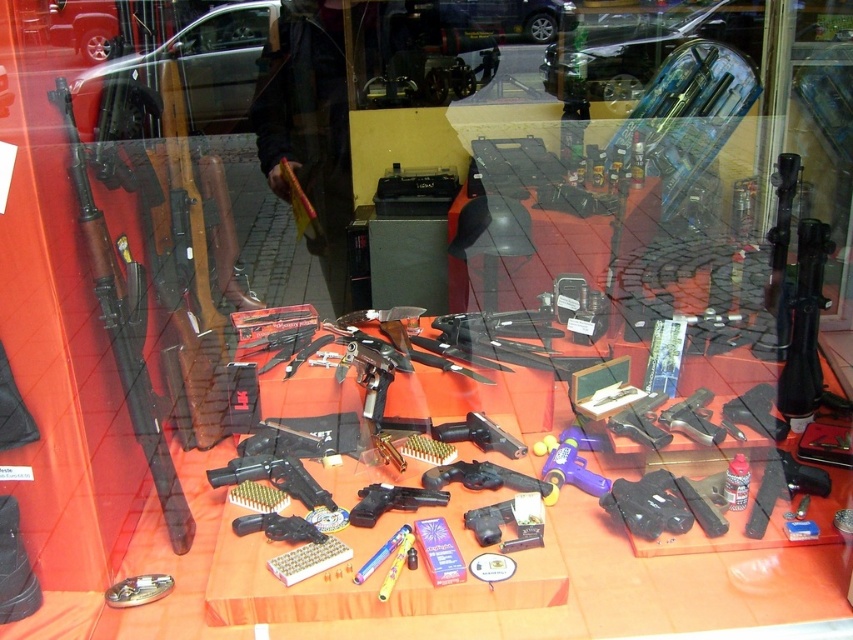
You are a customer looking at the display case of firearms. You notice the wooden rifle at left and the polished black handgun at center. Which one is positioned higher in the display?

The wooden rifle at left is located above the polished black handgun at center, so it is positioned higher in the display.

You are a customer at the store and want to know which handgun is taller between the polished black handgun at center and the matte black handgun at center. Can you tell me?

The polished black handgun at center is much taller than the matte black handgun at center.